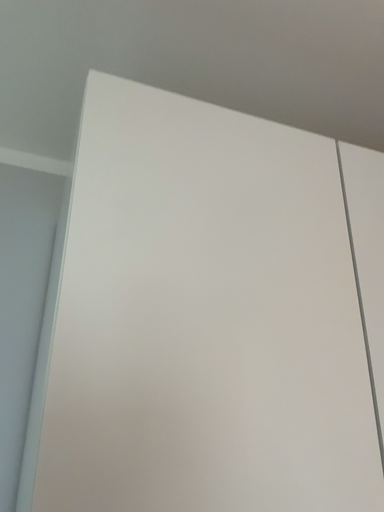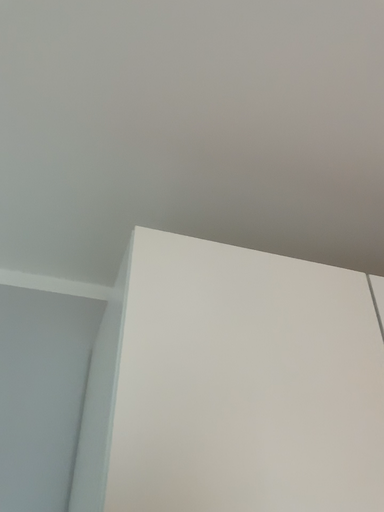
Question: How did the camera likely rotate when shooting the video?

Choices:
 (A) rotated downward
 (B) rotated upward

Answer: (B)